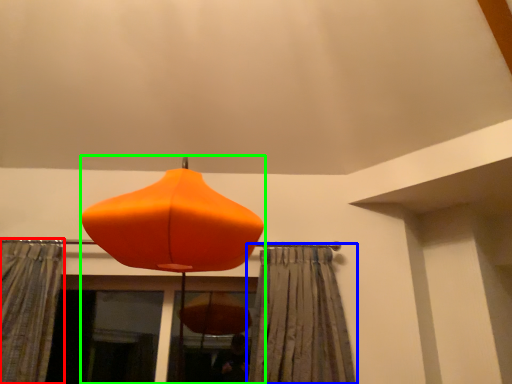
Question: Which is farther away from curtain (highlighted by a red box)? curtain (highlighted by a blue box) or lamp (highlighted by a green box)?

Choices:
 (A) curtain
 (B) lamp

Answer: (A)